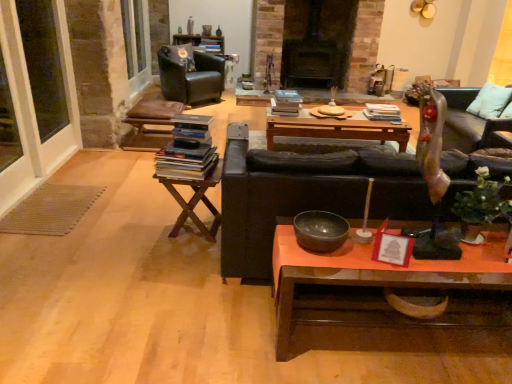
Find the location of a particular element. The width and height of the screenshot is (512, 384). free space to the back side of hardcover book at center, which is the second book from bottom to top is located at coordinates (373, 113).